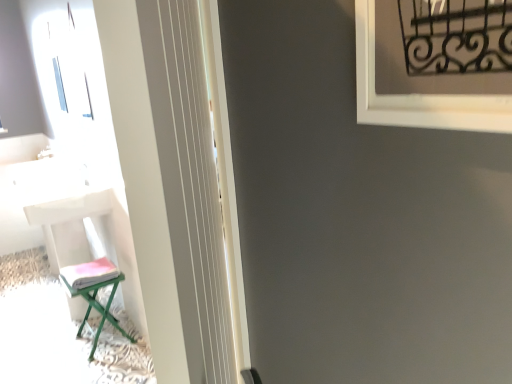
Question: Is green metallic stool at lower left, the second furniture positioned from the left, taller or shorter than white glossy table at left?

Choices:
 (A) tall
 (B) short

Answer: (B)

Question: Looking at the image, does green metallic stool at lower left, the second furniture positioned from the left, seem bigger or smaller compared to white glossy table at left?

Choices:
 (A) big
 (B) small

Answer: (B)

Question: Which is nearer to the white glossy table at left?

Choices:
 (A) green metallic stool at lower left, the 1th furniture positioned from the right
 (B) white plastic chair at left, the 1th furniture in the left-to-right sequence
 (C) black wrought iron at upper right
 (D) white glossy screen door at left

Answer: (B)

Question: Considering the real-world distances, which object is farthest from the white glossy screen door at left?

Choices:
 (A) white plastic chair at left, marked as the second furniture in a right-to-left arrangement
 (B) white glossy table at left
 (C) black wrought iron at upper right
 (D) green metallic stool at lower left, the 1th furniture positioned from the right

Answer: (B)